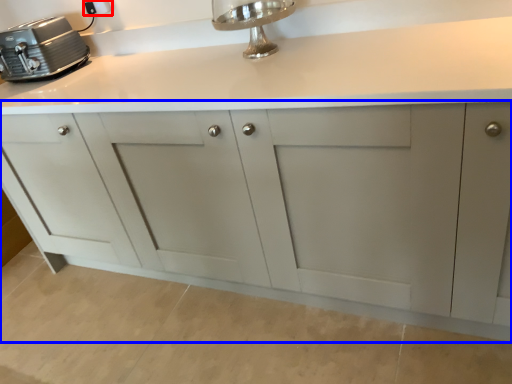
Question: Among these objects, which one is nearest to the camera, electric outlet (highlighted by a red box) or cabinetry (highlighted by a blue box)?

Choices:
 (A) electric outlet
 (B) cabinetry

Answer: (B)